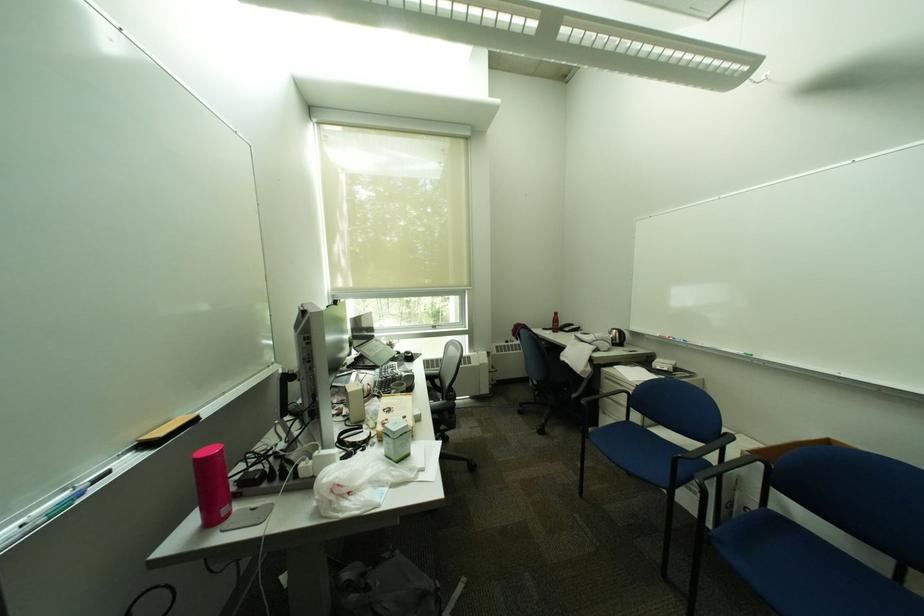
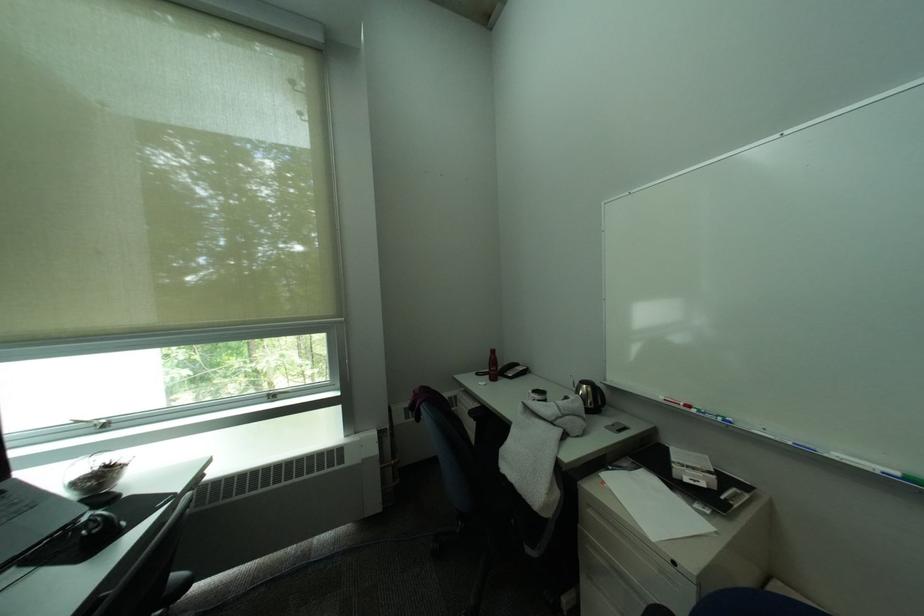
Where in the second image is the point corresponding to [420,355] from the first image?

(106, 528)